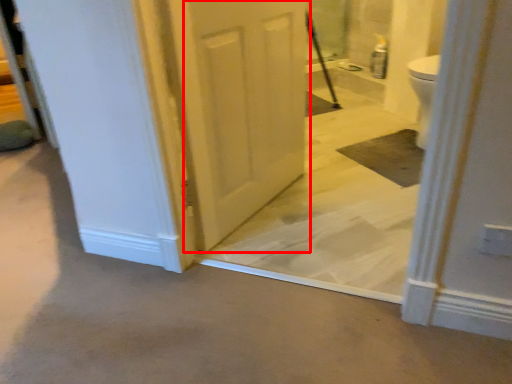
Question: Considering the relative positions of door (annotated by the red box) and concrete in the image provided, where is door (annotated by the red box) located with respect to the staircase?

Choices:
 (A) right
 (B) left

Answer: (A)